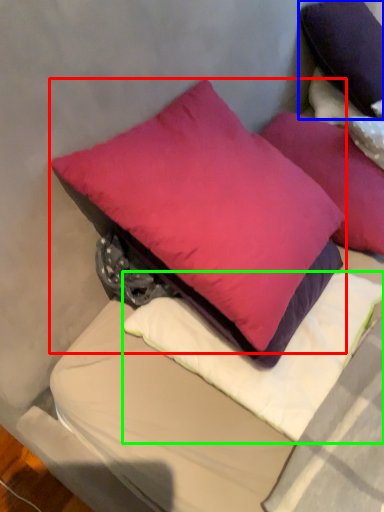
Question: Considering the real-world distances, which object is farthest from pillow (highlighted by a red box)? pillow (highlighted by a blue box) or pillow (highlighted by a green box)?

Choices:
 (A) pillow
 (B) pillow

Answer: (A)